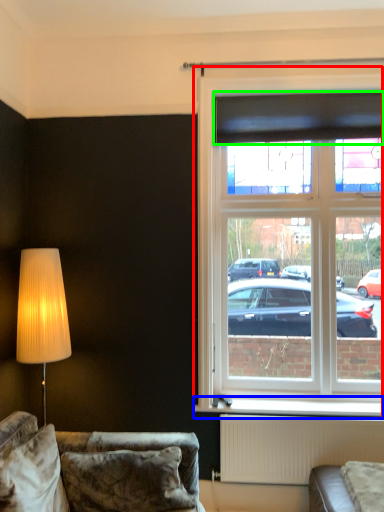
Question: Which object is the farthest from window (highlighted by a red box)? Choose among these: window sill (highlighted by a blue box) or curtain (highlighted by a green box).

Choices:
 (A) window sill
 (B) curtain

Answer: (A)